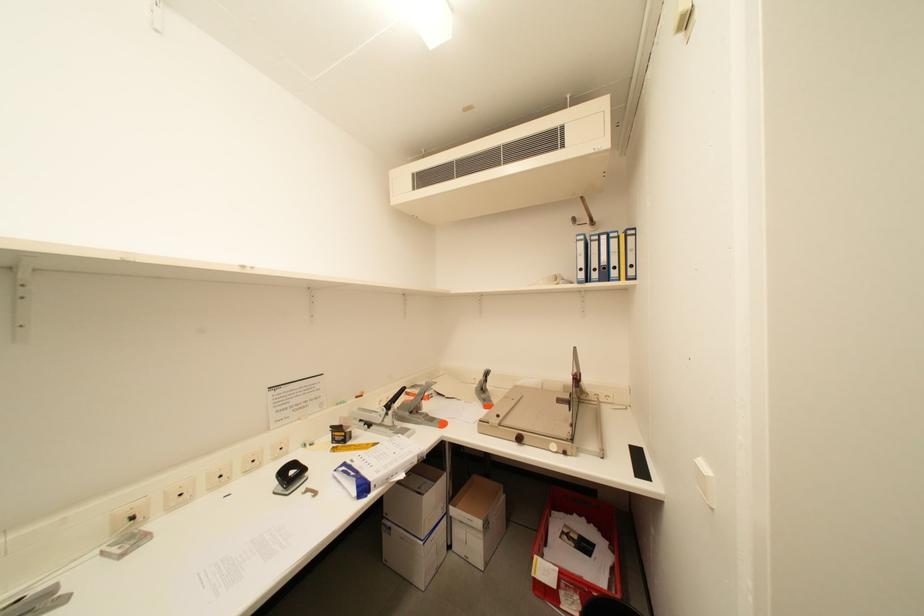
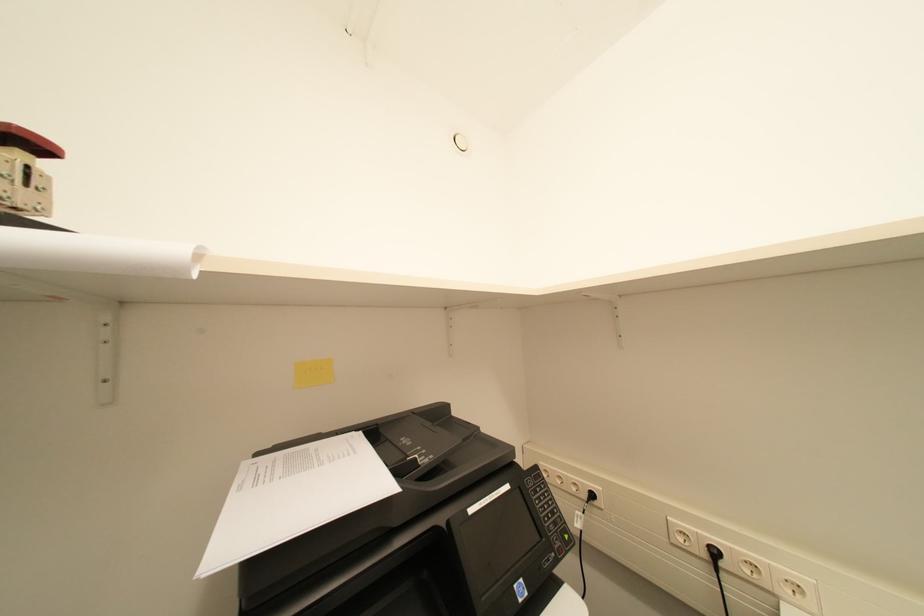
Question: The first image is from the beginning of the video and the second image is from the end. How did the camera likely rotate when shooting the video?

Choices:
 (A) Left
 (B) Right
 (C) Up
 (D) Down

Answer: (A)